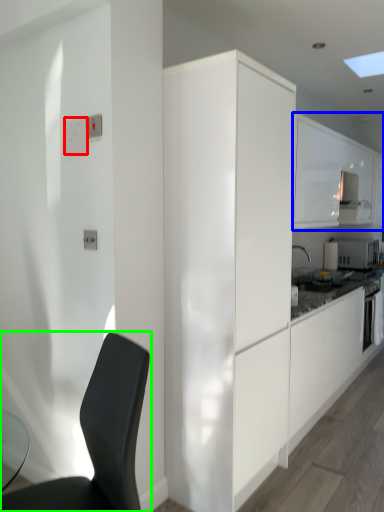
Question: Which object is the closest to the light switch (highlighted by a red box)? Choose among these: cabinetry (highlighted by a blue box) or chair (highlighted by a green box).

Choices:
 (A) cabinetry
 (B) chair

Answer: (B)